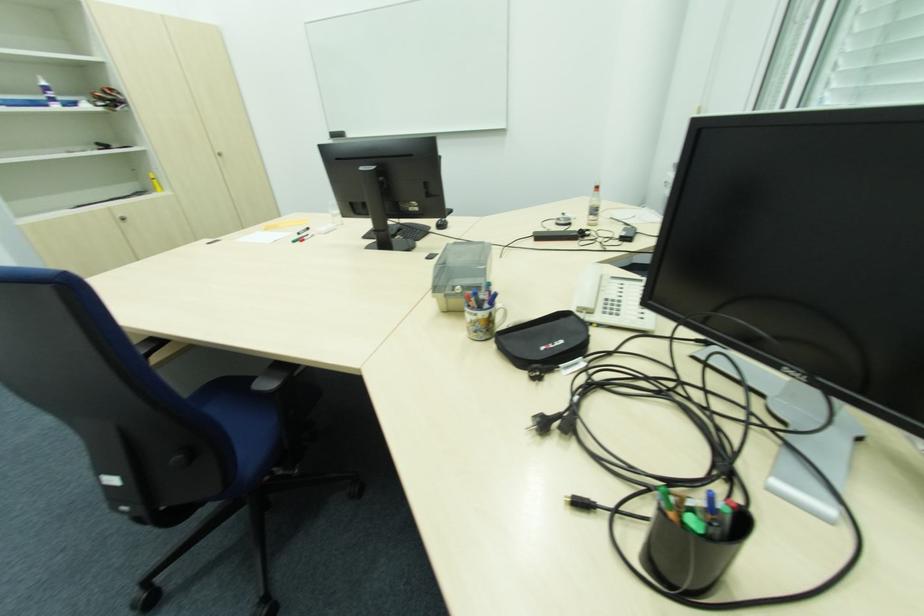
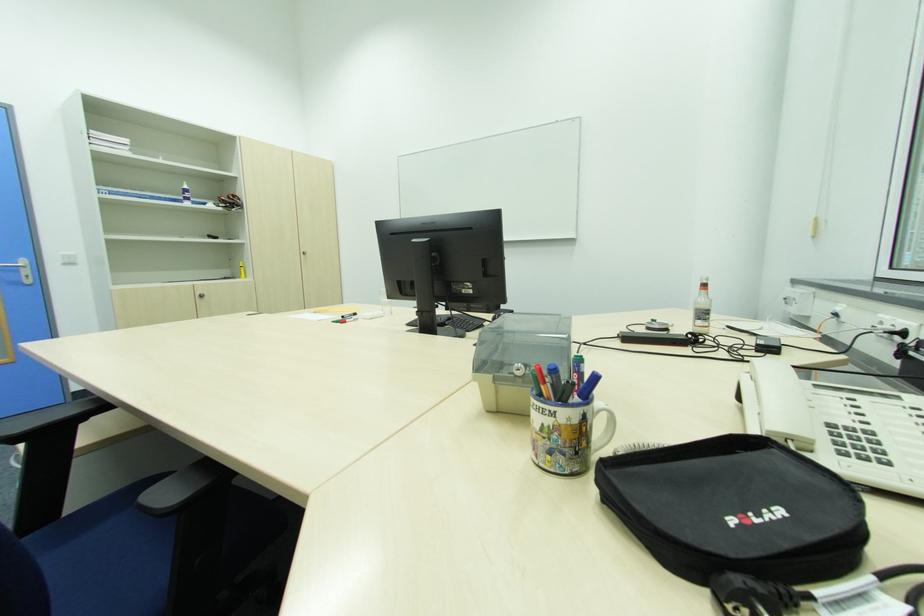
Locate, in the second image, the point that corresponds to (x=159, y=191) in the first image.

(244, 277)